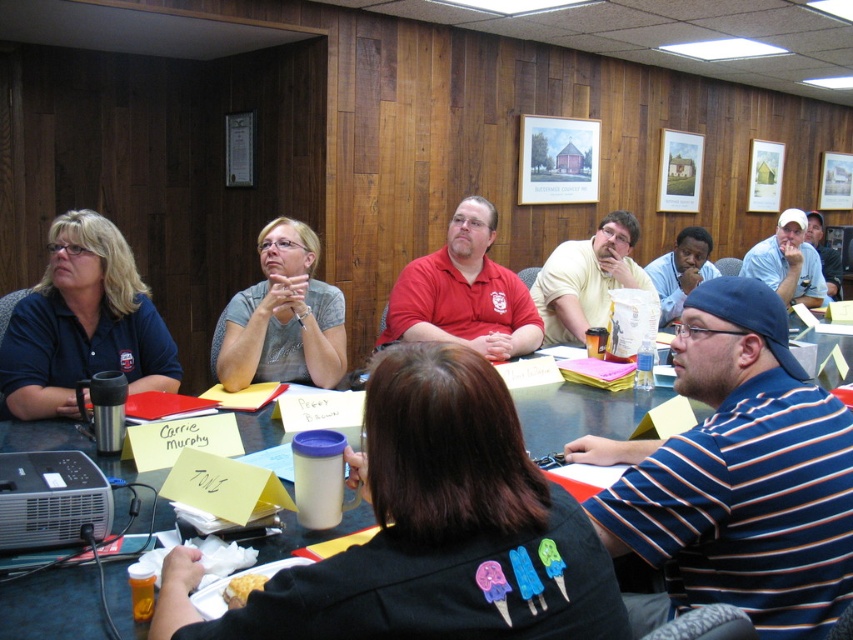
Question: Does black plastic table at center appear under matte gray shirt at center?

Choices:
 (A) yes
 (B) no

Answer: (A)

Question: Estimate the real-world distances between objects in this image. Which object is farther from the yellow cotton shirt at center?

Choices:
 (A) matte blue shirt at left
 (B) matte red shirt at center
 (C) blue striped shirt at center

Answer: (C)

Question: Which object appears closest to the camera in this image?

Choices:
 (A) matte gray shirt at center
 (B) yellow cotton shirt at center

Answer: (A)

Question: In this image, where is blue striped shirt at center located relative to yellow cotton shirt at center?

Choices:
 (A) left
 (B) right

Answer: (A)

Question: Which is nearer to the white cap at upper right?

Choices:
 (A) yellow cotton shirt at center
 (B) matte gray shirt at center

Answer: (A)

Question: Is the position of matte gray shirt at center less distant than that of matte red shirt at center?

Choices:
 (A) yes
 (B) no

Answer: (A)